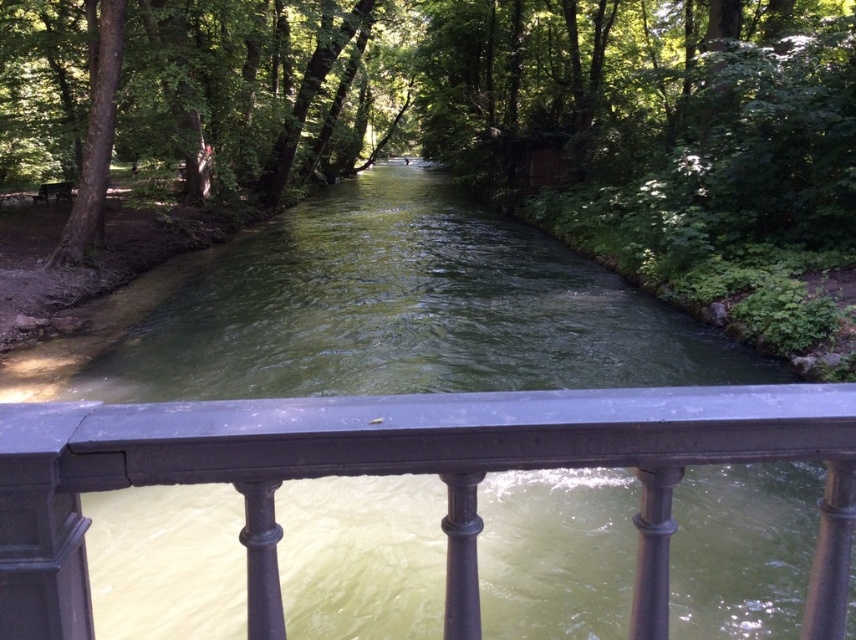
Question: Is green leafy tree at center to the right of green leafy tree at left from the viewer's perspective?

Choices:
 (A) yes
 (B) no

Answer: (A)

Question: Estimate the real-world distances between objects in this image. Which object is closer to the green leafy tree at left?

Choices:
 (A) black metal railing at center
 (B) green leafy tree at center

Answer: (A)

Question: Does green leafy tree at center come behind green leafy tree at left?

Choices:
 (A) no
 (B) yes

Answer: (A)

Question: Considering the real-world distances, which object is closest to the black metal railing at center?

Choices:
 (A) green leafy tree at left
 (B) green leafy tree at center

Answer: (A)

Question: Which object is positioned closest to the black metal railing at center?

Choices:
 (A) green leafy tree at center
 (B) green leafy tree at left

Answer: (B)

Question: Can you confirm if green leafy tree at center is wider than black metal railing at center?

Choices:
 (A) yes
 (B) no

Answer: (A)